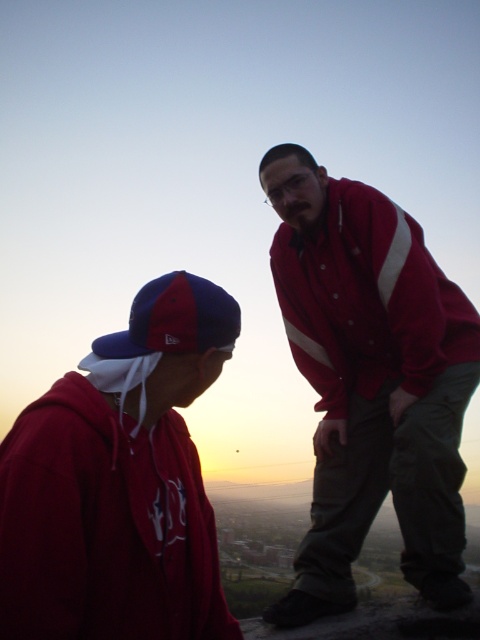
Consider the image. Does red matte jacket at right have a lesser height compared to matte red hoodie at left?

Incorrect, red matte jacket at right's height does not fall short of matte red hoodie at left's.

Which is in front, point (345, 492) or point (44, 548)?

Point (44, 548) is more forward.

Who is more distant from viewer, (x=462, y=481) or (x=13, y=634)?

The point (x=462, y=481) is behind.

At what (x,y) coordinates should I click in order to perform the action: click on red matte jacket at right. Please return your answer as a coordinate pair (x, y). Image resolution: width=480 pixels, height=640 pixels. Looking at the image, I should click on (371, 381).

Who is more distant from viewer, (442, 400) or (167, 307)?

The point (442, 400) is more distant.

Can you confirm if red matte jacket at right is taller than blue fabric baseball cap at lower left?

Correct, red matte jacket at right is much taller as blue fabric baseball cap at lower left.

Is point (405, 508) farther from viewer compared to point (194, 349)?

That is True.

Where is `red matte jacket at right`? The height and width of the screenshot is (640, 480). red matte jacket at right is located at coordinates (371, 381).

Is matte red hoodie at left below blue fabric baseball cap at lower left?

Indeed, matte red hoodie at left is positioned under blue fabric baseball cap at lower left.

Who is positioned more to the right, matte red hoodie at left or blue fabric baseball cap at lower left?

matte red hoodie at left is more to the right.

Who is more distant from viewer, (154, 428) or (164, 292)?

The point (154, 428) is more distant.

Where is `matte red hoodie at left`? matte red hoodie at left is located at coordinates tap(119, 484).